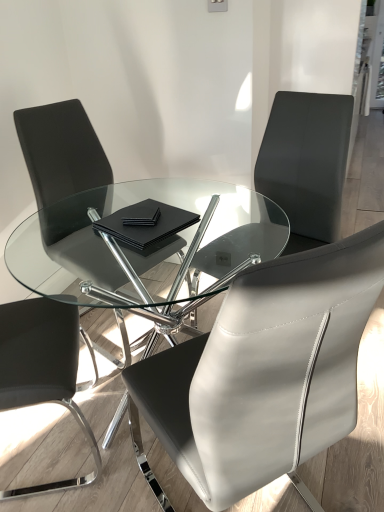
Question: Is transparent glass table at center taller or shorter than black matte notebook at center?

Choices:
 (A) short
 (B) tall

Answer: (B)

Question: Looking at the image, does transparent glass table at center seem bigger or smaller compared to black matte notebook at center?

Choices:
 (A) big
 (B) small

Answer: (A)

Question: Based on their relative distances, which object is farther from the black matte notebook at center?

Choices:
 (A) black leather chair at center, placed as the 2th chair when sorted from right to left
 (B) black leather chair at upper right, marked as the 1th chair in a right-to-left arrangement
 (C) matte black chair at left, arranged as the 3th chair when viewed from the right
 (D) black leather chair at left, the 1th chair positioned from the left
 (E) transparent glass table at center

Answer: (B)

Question: Which is nearer to the transparent glass table at center?

Choices:
 (A) black leather chair at upper right, marked as the 1th chair in a right-to-left arrangement
 (B) matte black chair at left, which ranks as the second chair in left-to-right order
 (C) black leather chair at center, arranged as the 3th chair when viewed from the left
 (D) black leather chair at left, the fourth chair positioned from the right
 (E) black matte notebook at center

Answer: (B)